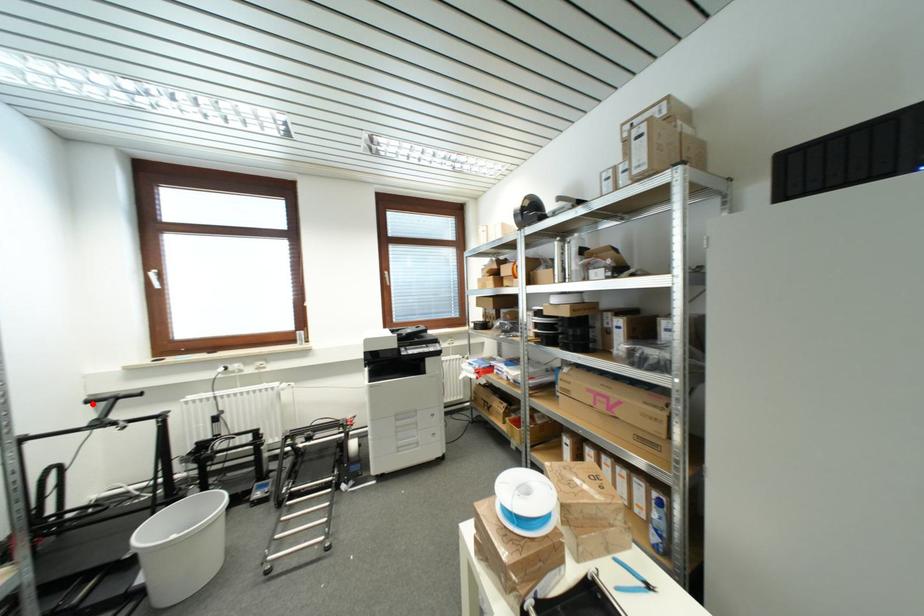
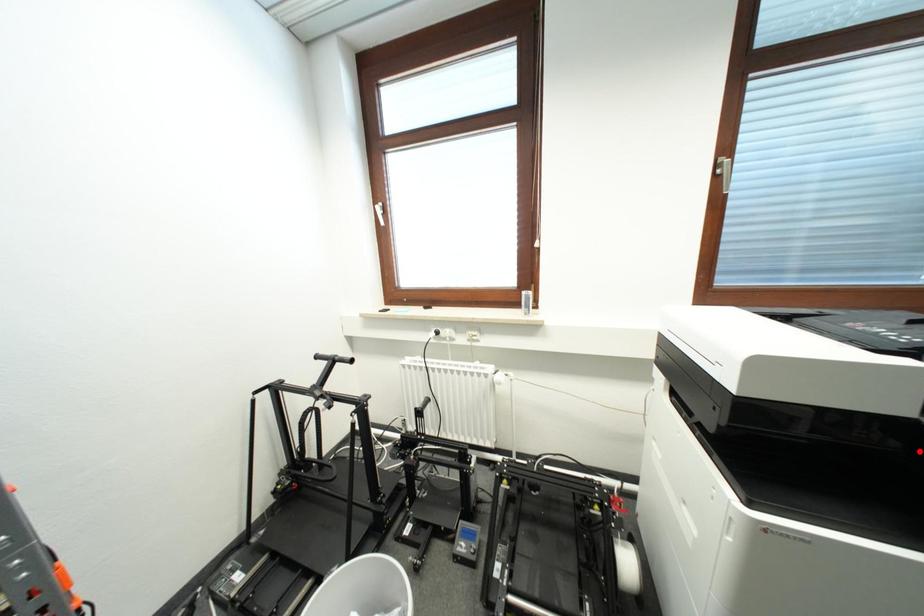
I am providing you with two images of the same scene from different viewpoints. A red point is marked on the first image and another point is marked on the second image. Does the point marked in image1 correspond to the same location as the one in image2?

No